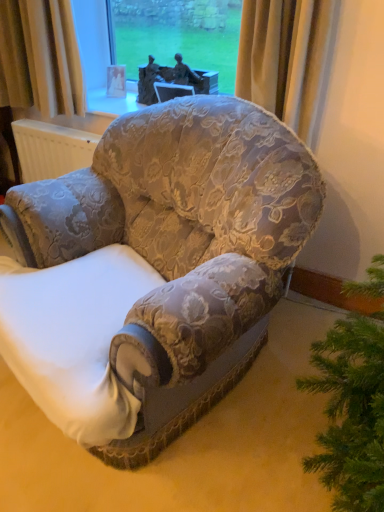
Question: Is floral fabric armchair at center turned away from bronze statue at upper center?

Choices:
 (A) yes
 (B) no

Answer: (B)

Question: Can you confirm if floral fabric armchair at center is taller than bronze statue at upper center?

Choices:
 (A) no
 (B) yes

Answer: (B)

Question: Is floral fabric armchair at center positioned beyond the bounds of bronze statue at upper center?

Choices:
 (A) no
 (B) yes

Answer: (B)

Question: From a real-world perspective, is floral fabric armchair at center beneath bronze statue at upper center?

Choices:
 (A) no
 (B) yes

Answer: (B)

Question: Is there a large distance between floral fabric armchair at center and bronze statue at upper center?

Choices:
 (A) no
 (B) yes

Answer: (B)

Question: Is floral fabric armchair at center facing towards bronze statue at upper center?

Choices:
 (A) yes
 (B) no

Answer: (B)

Question: Considering the relative sizes of bronze statue at upper center and floral fabric armchair at center in the image provided, is bronze statue at upper center shorter than floral fabric armchair at center?

Choices:
 (A) no
 (B) yes

Answer: (B)

Question: Can floral fabric armchair at center be found inside bronze statue at upper center?

Choices:
 (A) no
 (B) yes

Answer: (A)

Question: From a real-world perspective, is bronze statue at upper center located higher than floral fabric armchair at center?

Choices:
 (A) no
 (B) yes

Answer: (B)

Question: Is bronze statue at upper center closer to camera compared to floral fabric armchair at center?

Choices:
 (A) no
 (B) yes

Answer: (A)

Question: Is bronze statue at upper center oriented away from floral fabric armchair at center?

Choices:
 (A) no
 (B) yes

Answer: (A)

Question: Is bronze statue at upper center thinner than floral fabric armchair at center?

Choices:
 (A) no
 (B) yes

Answer: (B)

Question: Looking at their shapes, would you say bronze statue at upper center is wider or thinner than floral fabric armchair at center?

Choices:
 (A) thin
 (B) wide

Answer: (A)